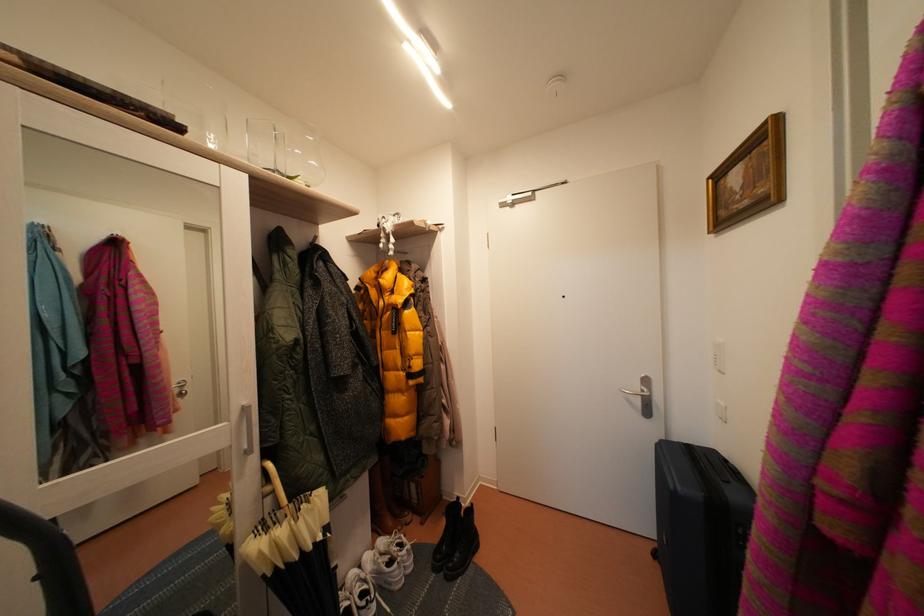
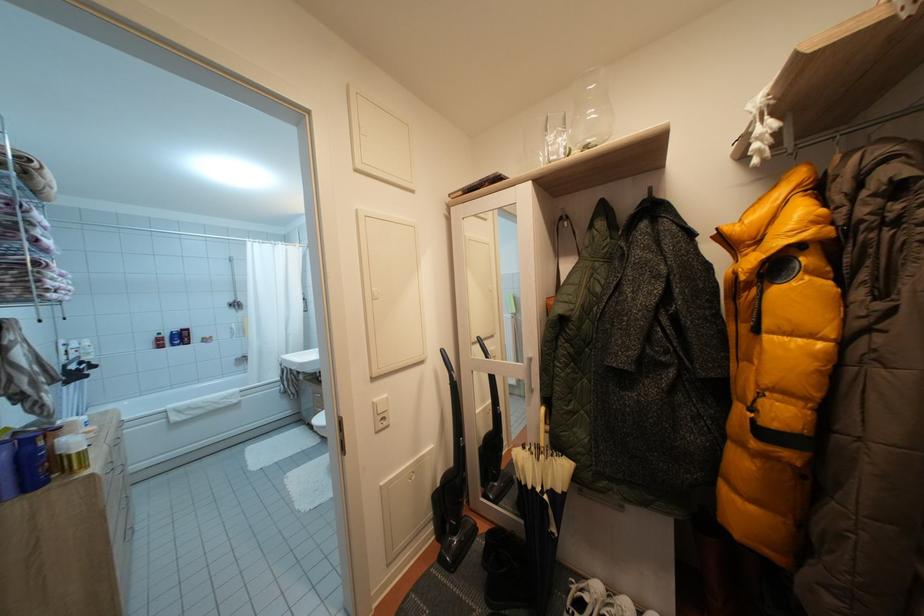
Question: The first image is from the beginning of the video and the second image is from the end. How did the camera likely rotate when shooting the video?

Choices:
 (A) Left
 (B) Right
 (C) Up
 (D) Down

Answer: (A)